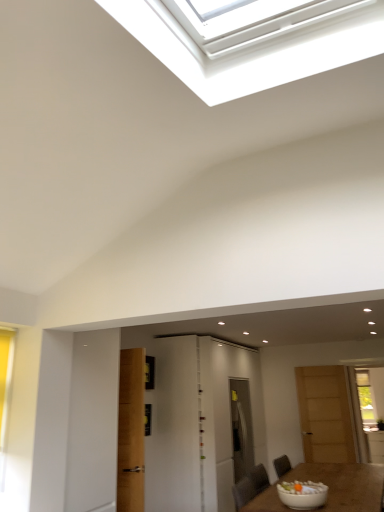
Question: Can you confirm if white glossy door at center, which is counted as the 1th door, starting from the left, is shorter than white glossy bowl at lower right?

Choices:
 (A) no
 (B) yes

Answer: (A)

Question: Is white glossy door at center, which is counted as the 3th door, starting from the right, located outside white glossy bowl at lower right?

Choices:
 (A) no
 (B) yes

Answer: (B)

Question: Is white glossy door at center, which is counted as the 1th door, starting from the left, positioned with its back to white glossy bowl at lower right?

Choices:
 (A) no
 (B) yes

Answer: (A)

Question: Is white glossy door at center, which is counted as the 1th door, starting from the left, oriented towards white glossy bowl at lower right?

Choices:
 (A) no
 (B) yes

Answer: (A)

Question: Does white glossy door at center, which is counted as the 1th door, starting from the left, lie behind white glossy bowl at lower right?

Choices:
 (A) no
 (B) yes

Answer: (B)

Question: From the image's perspective, relative to white glossy bowl at lower right, is white glossy door at center, which is counted as the 3th door, starting from the right, above or below?

Choices:
 (A) below
 (B) above

Answer: (A)

Question: Based on their positions, is white glossy door at center, which is counted as the 1th door, starting from the left, located to the left or right of white glossy bowl at lower right?

Choices:
 (A) right
 (B) left

Answer: (B)

Question: Looking at their shapes, would you say white glossy door at center, which is counted as the 3th door, starting from the right, is wider or thinner than white glossy bowl at lower right?

Choices:
 (A) thin
 (B) wide

Answer: (B)

Question: Looking at the image, does white glossy door at center, which is counted as the 1th door, starting from the left, seem bigger or smaller compared to white glossy bowl at lower right?

Choices:
 (A) big
 (B) small

Answer: (A)

Question: Is white glossy door at center, which is counted as the 1th door, starting from the left, taller or shorter than white glossy door at center, marked as the second door in a right-to-left arrangement?

Choices:
 (A) tall
 (B) short

Answer: (B)

Question: Is point (152, 458) closer or farther from the camera than point (190, 399)?

Choices:
 (A) closer
 (B) farther

Answer: (A)

Question: Would you say white glossy door at center, which is counted as the 3th door, starting from the right, is inside or outside white glossy door at center, placed as the 2th door when sorted from left to right?

Choices:
 (A) outside
 (B) inside

Answer: (A)

Question: Based on their sizes in the image, would you say white glossy door at center, which is counted as the 3th door, starting from the right, is bigger or smaller than white glossy door at center, placed as the 2th door when sorted from left to right?

Choices:
 (A) small
 (B) big

Answer: (A)

Question: Considering the positions of white glossy bowl at lower right and wooden door at right, which is the first door in right-to-left order, in the image, is white glossy bowl at lower right taller or shorter than wooden door at right, which is the first door in right-to-left order,?

Choices:
 (A) tall
 (B) short

Answer: (B)

Question: Considering their positions, is white glossy bowl at lower right located in front of or behind wooden door at right, marked as the 3th door in a left-to-right arrangement?

Choices:
 (A) behind
 (B) front

Answer: (B)